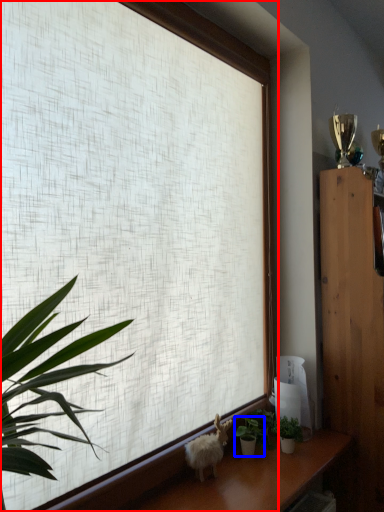
Question: Which object appears farthest to the camera in this image, window (highlighted by a red box) or houseplant (highlighted by a blue box)?

Choices:
 (A) window
 (B) houseplant

Answer: (B)